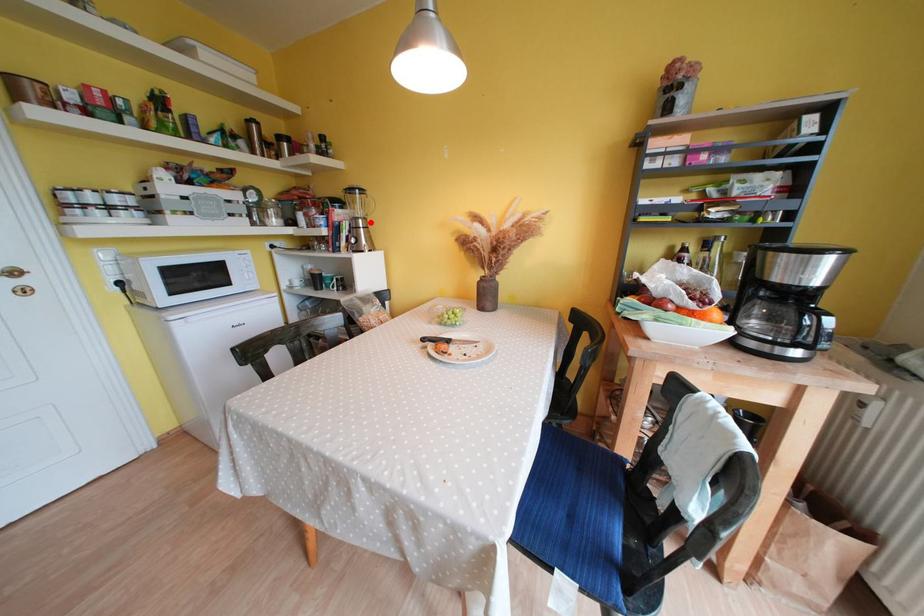
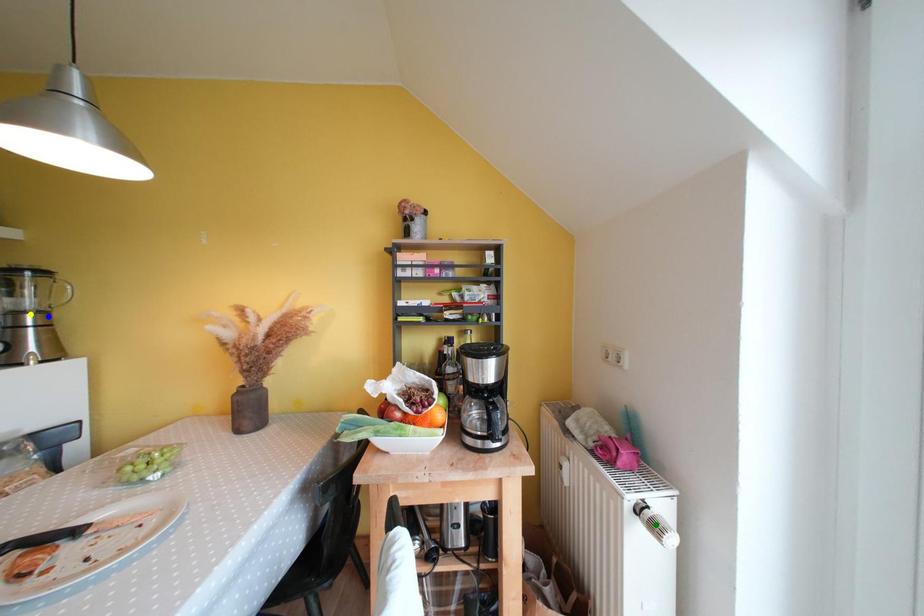
Question: I am providing you with two images of the same scene from different viewpoints. A red point is marked on the first image. You are given multiple points on the second image. Can you choose the point in image 2 that corresponds to the point in image 1?

Choices:
 (A) yellow point
 (B) blue point
 (C) green point

Answer: (B)